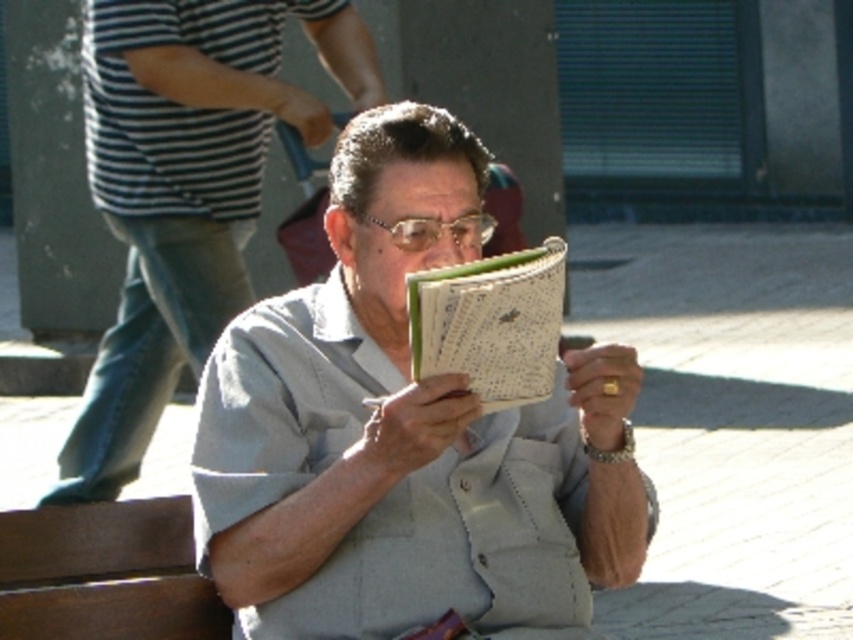
Which is in front, point (518, 504) or point (438, 339)?

Point (438, 339)

The image size is (853, 640). Identify the location of light gray fabric shirt at center. (404, 432).

I want to click on light gray fabric shirt at center, so [x=404, y=432].

Is gray fabric shirt at center wider than green textured notebook at center?

Correct, the width of gray fabric shirt at center exceeds that of green textured notebook at center.

From the picture: Who is shorter, gray fabric shirt at center or green textured notebook at center?

Standing shorter between the two is green textured notebook at center.

The width and height of the screenshot is (853, 640). Identify the location of gray fabric shirt at center. (184, 189).

Is light gray fabric shirt at center above gray fabric shirt at center?

Actually, light gray fabric shirt at center is below gray fabric shirt at center.

Consider the image. Is light gray fabric shirt at center shorter than gray fabric shirt at center?

Yes, light gray fabric shirt at center is shorter than gray fabric shirt at center.

Is point (560, 444) positioned after point (154, 390)?

No.

At what (x,y) coordinates should I click in order to perform the action: click on light gray fabric shirt at center. Please return your answer as a coordinate pair (x, y). Looking at the image, I should click on (404, 432).